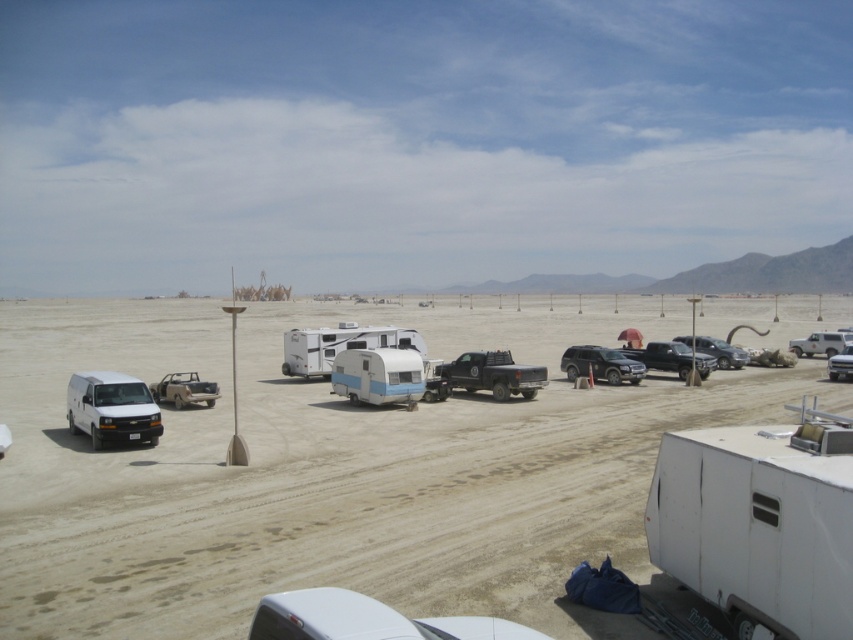
Question: Can you confirm if white matte trailer at center is smaller than white matte truck at center-right?

Choices:
 (A) yes
 (B) no

Answer: (B)

Question: Which is farther from the matte beige jeep at center-left?

Choices:
 (A) white matte truck at right
 (B) white matte van at left

Answer: (A)

Question: Is satin black suv at center to the left of metallic silver truck at center from the viewer's perspective?

Choices:
 (A) yes
 (B) no

Answer: (A)

Question: Is metallic silver truck at center to the right of white matte truck at right from the viewer's perspective?

Choices:
 (A) yes
 (B) no

Answer: (B)

Question: Among these points, which one is farthest from the camera?

Choices:
 (A) [212, 384]
 (B) [109, 394]
 (C) [705, 586]

Answer: (A)

Question: Estimate the real-world distances between objects in this image. Which object is farther from the metallic silver truck at center?

Choices:
 (A) matte beige jeep at center-left
 (B) white matte truck at center-right
 (C) white matte truck at right

Answer: (A)